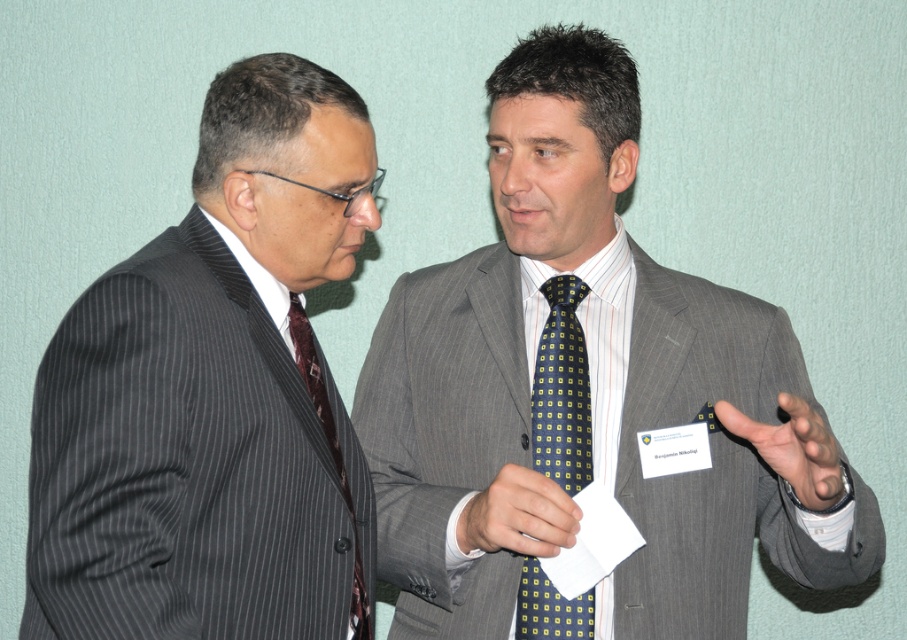
You are a photographer setting up for a portrait. You need to ensure that the matte black suit at left and the yellow dotted tie at center are both visible in the frame. Based on their positions, which object should you focus on first to capture both in the frame?

The matte black suit at left is located above the yellow dotted tie at center, so focusing on the matte black suit at left first will ensure both are in the frame as the yellow dotted tie at center is below it.

You are a photographer setting up for a portrait. You need to ensure that both the matte black suit at left and the maroon silk tie at left are visible in the frame. Based on their positions, which one should you focus on first to ensure the other remains in the background?

The matte black suit at left is in front of the maroon silk tie at left, so you should focus on the matte black suit at left first to keep the maroon silk tie at left in the background.